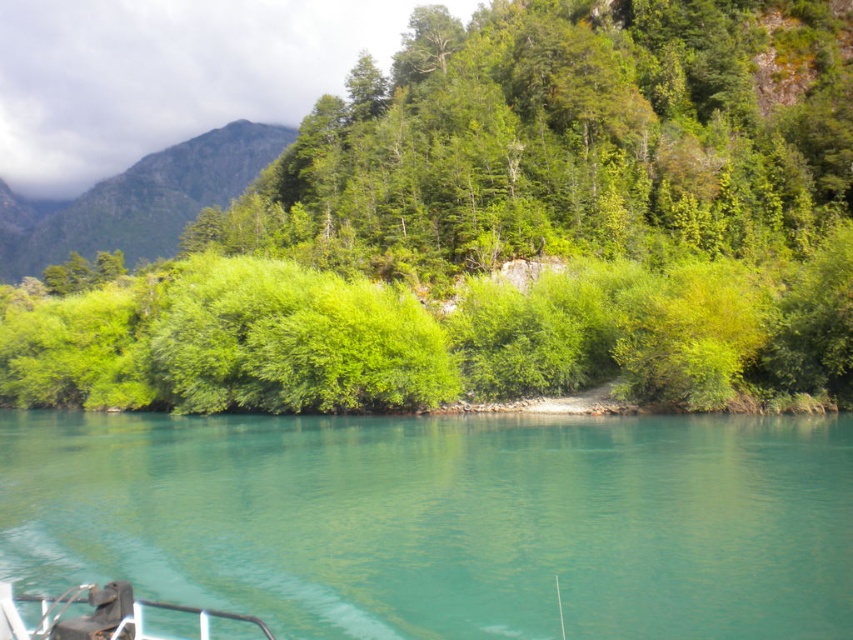
Does green leafy shrub at center appear on the left side of black rubber boat at lower left?

Correct, you'll find green leafy shrub at center to the left of black rubber boat at lower left.

What do you see at coordinates (509, 227) in the screenshot? Image resolution: width=853 pixels, height=640 pixels. I see `green leafy shrub at center` at bounding box center [509, 227].

Is point (424, 333) positioned behind point (111, 602)?

Yes, point (424, 333) is farther from viewer.

Where is `green leafy shrub at center`? The image size is (853, 640). green leafy shrub at center is located at coordinates (509, 227).

Who is positioned more to the left, green water at center or green leafy hillside at upper left?

green leafy hillside at upper left

Can you confirm if green water at center is wider than green leafy hillside at upper left?

In fact, green water at center might be narrower than green leafy hillside at upper left.

You are a GUI agent. You are given a task and a screenshot of the screen. Output one action in this format:
    pyautogui.click(x=<x>, y=<y>)
    Task: Click on the green water at center
    This screenshot has height=640, width=853.
    Given the screenshot: What is the action you would take?
    pyautogui.click(x=444, y=520)

At what (x,y) coordinates should I click in order to perform the action: click on green water at center. Please return your answer as a coordinate pair (x, y). This screenshot has height=640, width=853. Looking at the image, I should click on (444, 520).

Can you confirm if green leafy hillside at upper left is bigger than black rubber boat at lower left?

Correct, green leafy hillside at upper left is larger in size than black rubber boat at lower left.

Is green leafy hillside at upper left thinner than black rubber boat at lower left?

No.

Is point (68, 211) farther from camera compared to point (201, 637)?

Yes, it is behind point (201, 637).

Where is `green leafy hillside at upper left`? green leafy hillside at upper left is located at coordinates (137, 200).